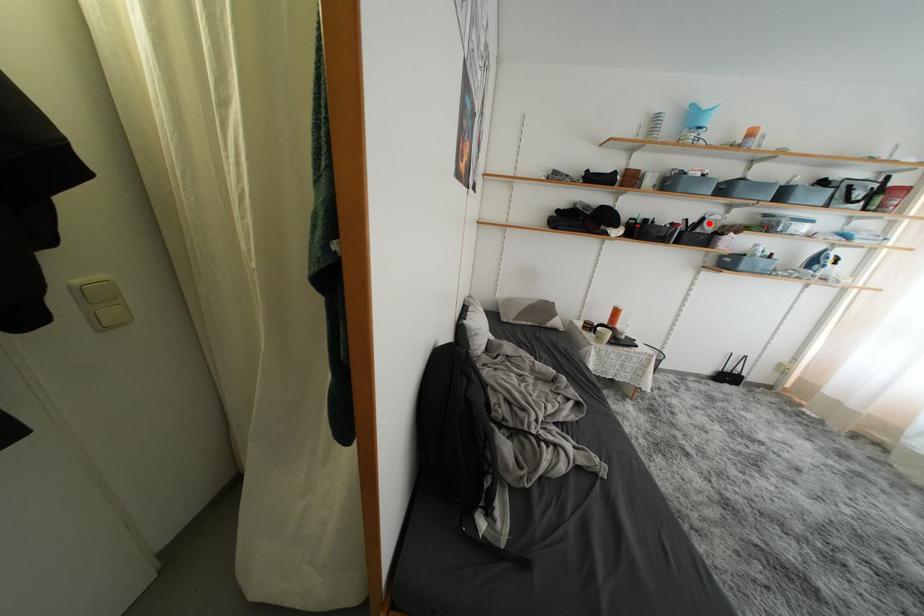
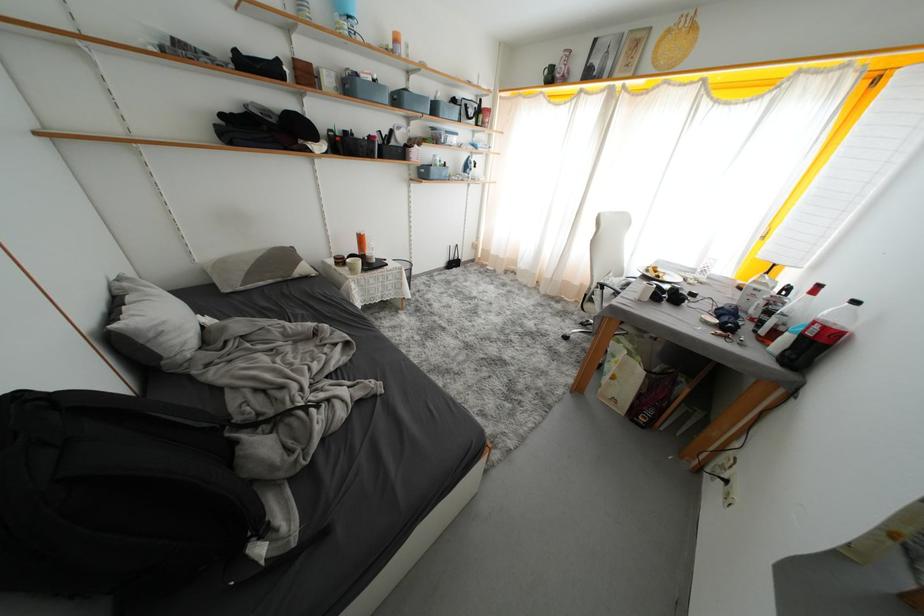
Question: I am providing you with two images of the same scene from different viewpoints. Given a red point in image1, look at the same physical point in image2. Is it:

Choices:
 (A) Closer to the viewpoint
 (B) Farther from the viewpoint

Answer: (A)